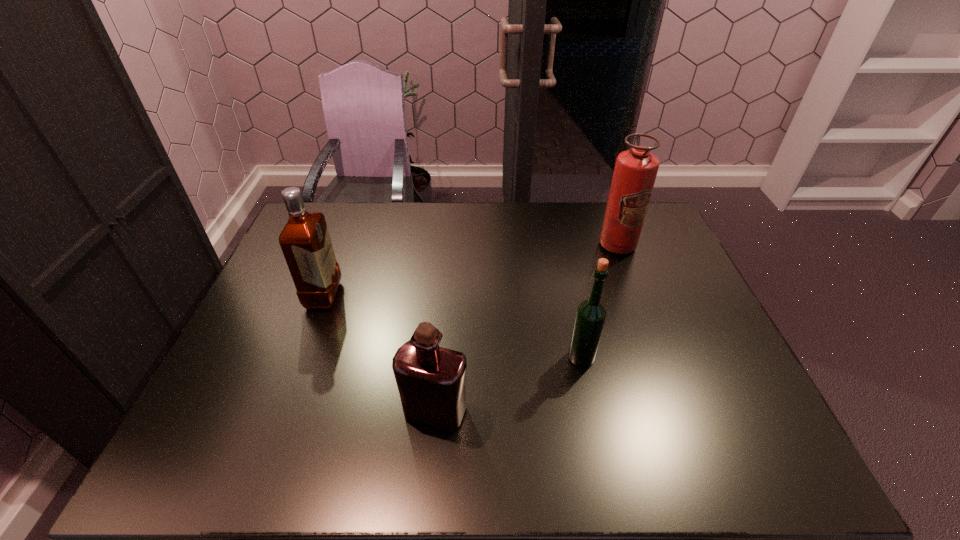
Image resolution: width=960 pixels, height=540 pixels. I want to click on the rightmost object, so click(635, 171).

At what (x,y) coordinates should I click in order to perform the action: click on fire extinguisher. Please return your answer as a coordinate pair (x, y). Looking at the image, I should click on (635, 171).

Where is `the farthest liquor`? the farthest liquor is located at coordinates (305, 241).

Identify the location of the leftmost object. This screenshot has height=540, width=960. (305, 241).

I want to click on the rightmost liquor, so click(591, 314).

Image resolution: width=960 pixels, height=540 pixels. I want to click on the second farthest liquor, so click(591, 314).

Locate an element on the screen. the nearest object is located at coordinates (431, 380).

I want to click on the second liquor from left to right, so click(431, 380).

Image resolution: width=960 pixels, height=540 pixels. In order to click on vacant region located on the label side of the rightmost object in this screenshot , I will do `click(638, 303)`.

At what (x,y) coordinates should I click in order to perform the action: click on free space located on the front label of the leftmost liquor. Please return your answer as a coordinate pair (x, y). This screenshot has height=540, width=960. Looking at the image, I should click on (394, 295).